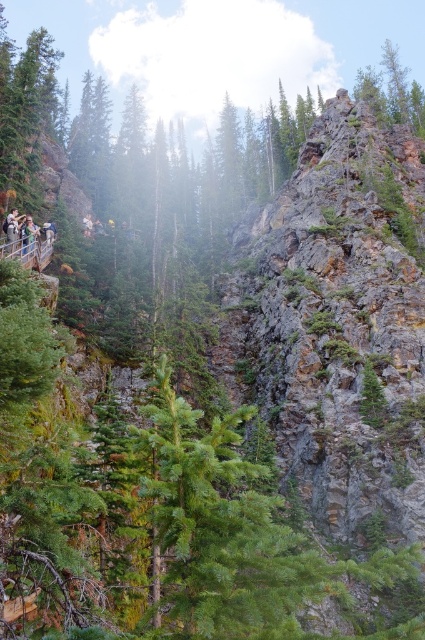
You are a hiker who has just arrived at the base of the cliff. You see a point marked as point (27, 237). Is this point likely to be a safe spot to set up a tent?

Answer: The point marked as point (27, 237) corresponds to a matte black backpack at left. Since the backpack is an object carried by a person, it is not a location suitable for setting up a tent. Choose a flat area away from the cliff edge for safety.

Consider the image. You are a hiker who has just arrived at the base of the cliff. You need to retrieve your matte black backpack at left and check the light brown wooden signpost at left for directions. Can you reach both items without moving more than 3 feet from your current position?

The distance between the matte black backpack at left and the light brown wooden signpost at left is 35.26 inches, which is approximately 2.94 feet. Since this distance is within the 3 feet limit, you can reach both items without moving more than 3 feet from your current position.

You are hiking along a steep cliff path and see the matte black backpack at left and the light brown wooden signpost at left. Which object is positioned closer to the cliff edge?

The matte black backpack at left is positioned closer to the cliff edge because it is to the right of the light brown wooden signpost at left, which is further away from the edge.